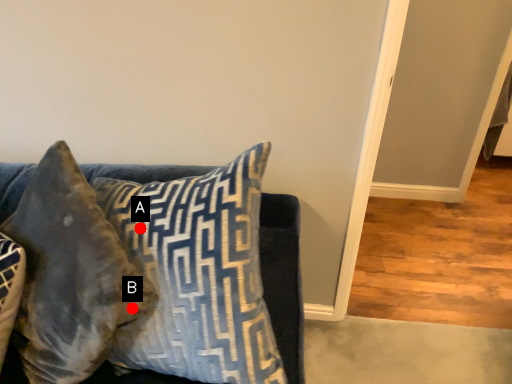
Question: Two points are circled on the image, labeled by A and B beside each circle. Among these points, which one is farthest from the camera?

Choices:
 (A) A is further
 (B) B is further

Answer: (A)